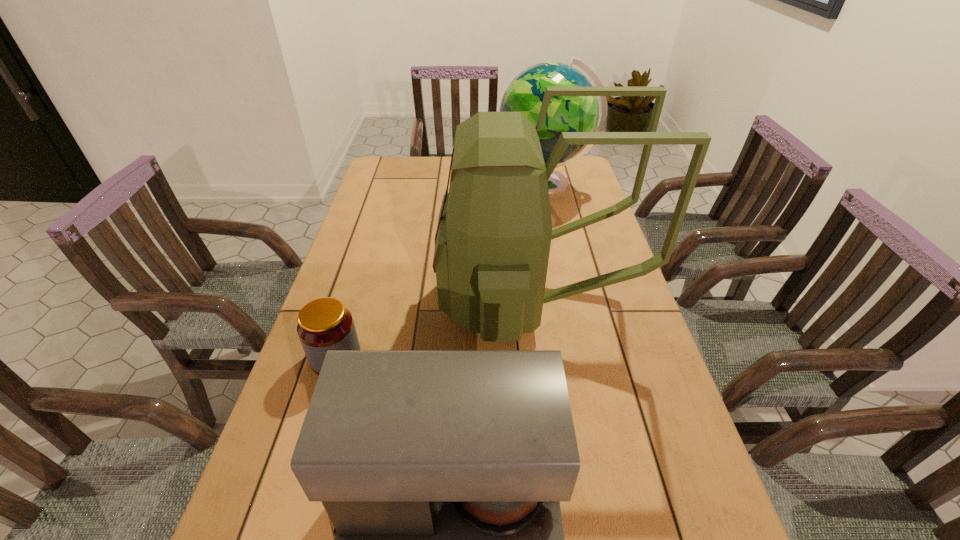
The height and width of the screenshot is (540, 960). Identify the location of vacant area at the far right corner of the desktop. (581, 174).

The height and width of the screenshot is (540, 960). Find the location of `free space between the backpack and the shortest object`. free space between the backpack and the shortest object is located at coordinates (435, 329).

You are a GUI agent. You are given a task and a screenshot of the screen. Output one action in this format:
    pyautogui.click(x=<x>, y=<y>)
    Task: Click on the object that ranks as the third closest to the nearest object
    This screenshot has width=960, height=540.
    Given the screenshot: What is the action you would take?
    pyautogui.click(x=525, y=94)

You are a GUI agent. You are given a task and a screenshot of the screen. Output one action in this format:
    pyautogui.click(x=<x>, y=<y>)
    Task: Click on the third closest object to the nearest object
    
    Given the screenshot: What is the action you would take?
    pyautogui.click(x=525, y=94)